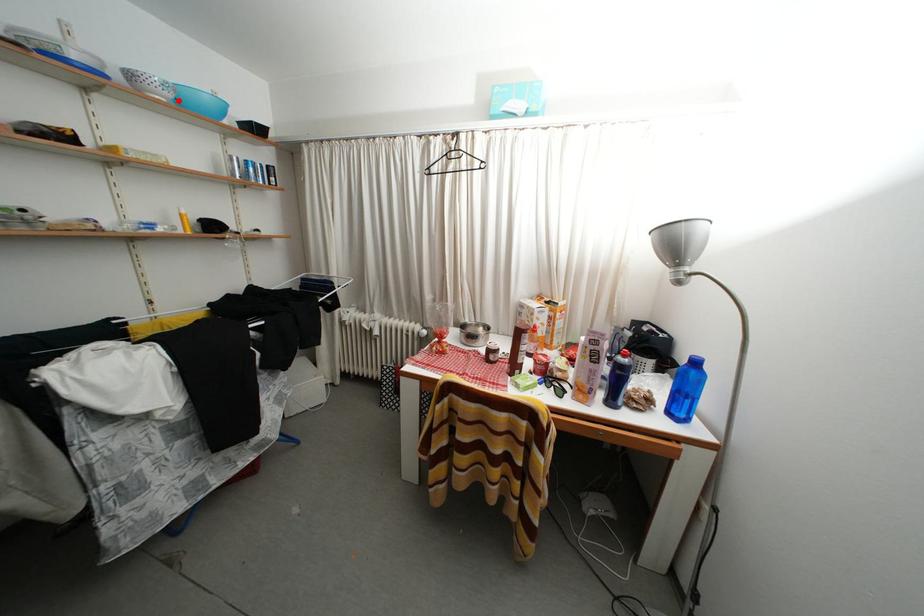
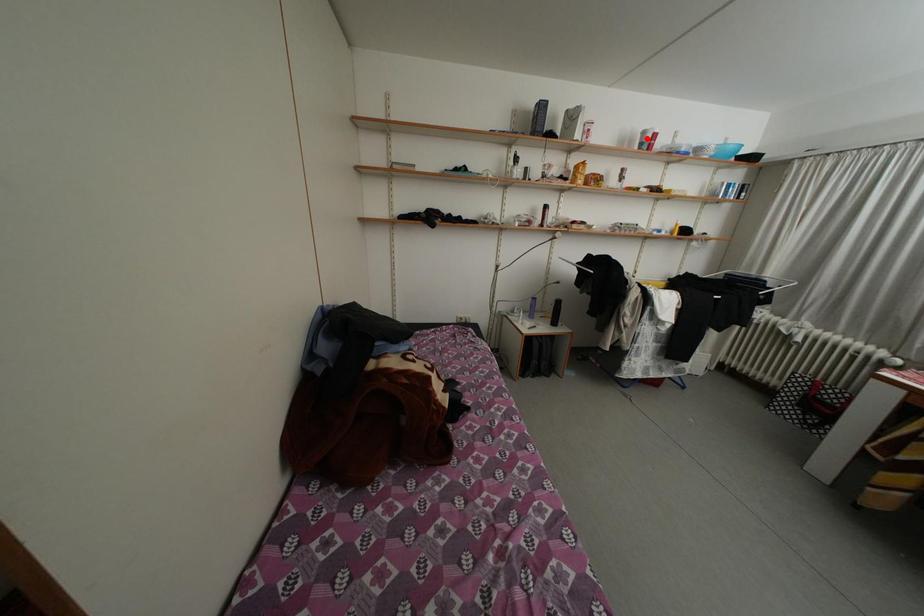
I am providing you with two images of the same scene from different viewpoints. A red point is marked on the first image and another point is marked on the second image. Does the point marked in image1 correspond to the same location as the one in image2?

No